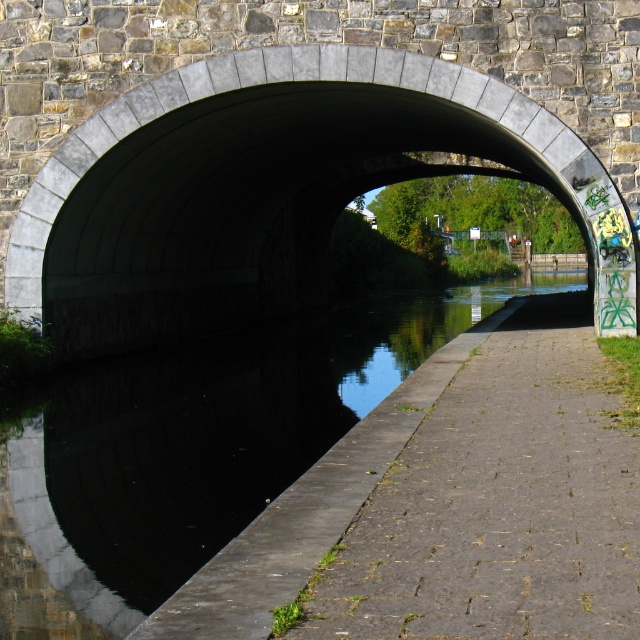
Question: Estimate the real-world distances between objects in this image. Which object is farther from the black concrete water at center?

Choices:
 (A) concrete archway at center
 (B) concrete paving at lower right

Answer: (B)

Question: Can you confirm if black concrete water at center is positioned to the left of concrete paving at lower right?

Choices:
 (A) no
 (B) yes

Answer: (B)

Question: Which object appears farthest from the camera in this image?

Choices:
 (A) black concrete water at center
 (B) concrete paving at lower right

Answer: (A)

Question: Which point appears closest to the camera in this image?

Choices:
 (A) (572, 515)
 (B) (444, 92)
 (C) (268, 477)

Answer: (A)

Question: Is concrete archway at center smaller than black concrete water at center?

Choices:
 (A) yes
 (B) no

Answer: (B)

Question: Observing the image, what is the correct spatial positioning of concrete archway at center in reference to concrete paving at lower right?

Choices:
 (A) left
 (B) right

Answer: (A)